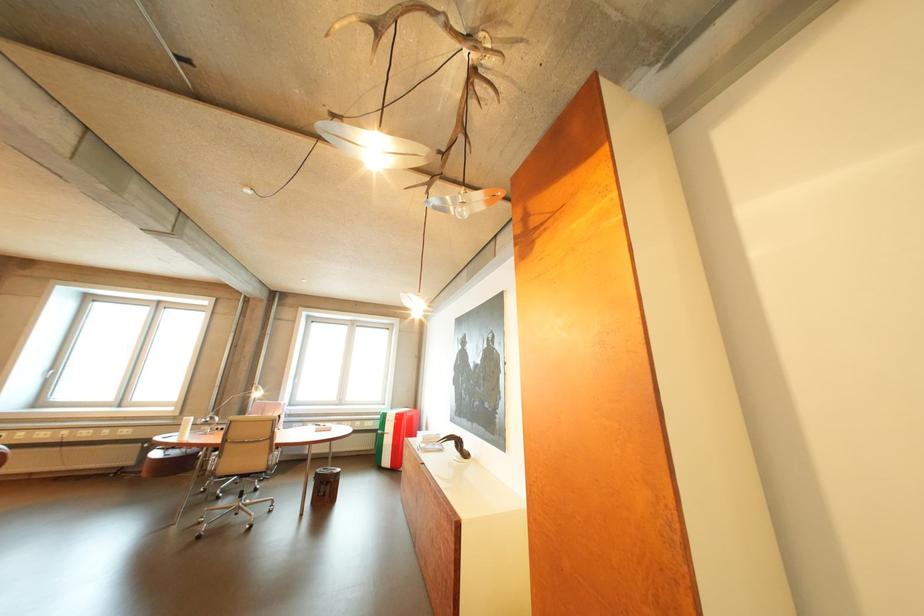
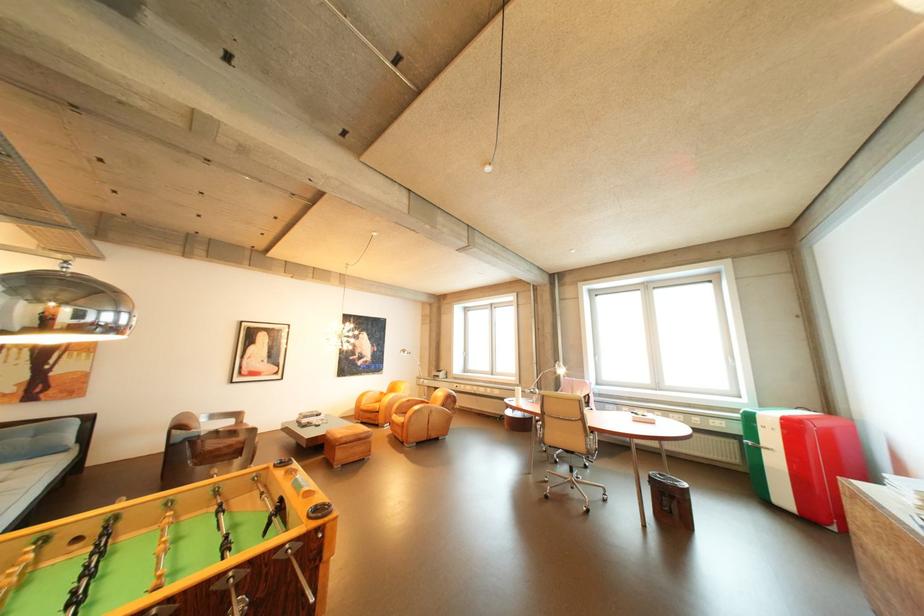
Find the pixel in the second image that matches point (387, 435) in the first image.

(748, 443)